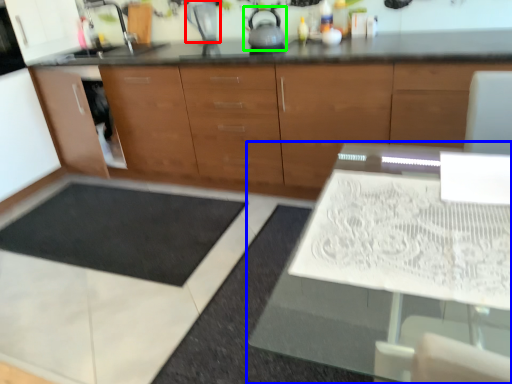
Question: Which object is the farthest from appliance (highlighted by a red box)? Choose among these: table (highlighted by a blue box) or tea pot (highlighted by a green box).

Choices:
 (A) table
 (B) tea pot

Answer: (A)